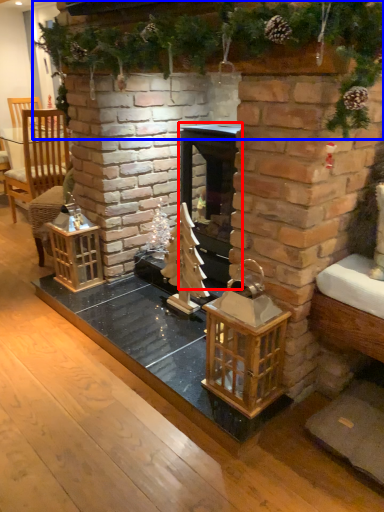
Question: Which of the following is the farthest to the observer, fireplace (highlighted by a red box) or christmas decoration (highlighted by a blue box)?

Choices:
 (A) fireplace
 (B) christmas decoration

Answer: (A)